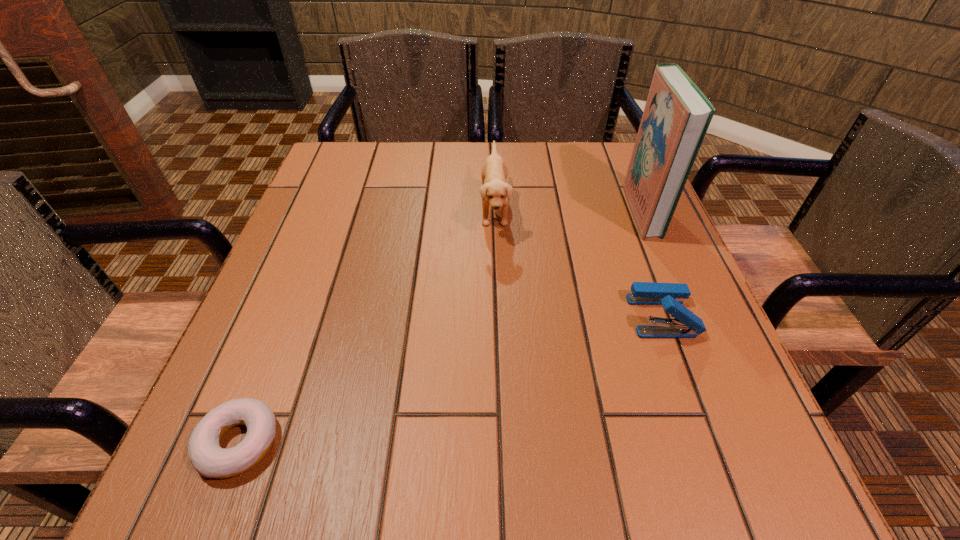
Identify the location of the tallest object. This screenshot has width=960, height=540. (676, 117).

Identify the location of the second object from left to right. Image resolution: width=960 pixels, height=540 pixels. (494, 191).

The height and width of the screenshot is (540, 960). Find the location of `the third shortest object`. the third shortest object is located at coordinates (494, 191).

The width and height of the screenshot is (960, 540). Identify the location of the second shortest object. (686, 324).

Locate an element on the screen. The height and width of the screenshot is (540, 960). the third farthest object is located at coordinates (686, 324).

Where is `the leftmost object`? The height and width of the screenshot is (540, 960). the leftmost object is located at coordinates (207, 457).

At what (x,y) coordinates should I click in order to perform the action: click on doughnut. Please return your answer as a coordinate pair (x, y). The width and height of the screenshot is (960, 540). Looking at the image, I should click on (207, 457).

Find the location of `vacant space located on the cover of the hardback book`. vacant space located on the cover of the hardback book is located at coordinates (491, 210).

I want to click on free region located on the cover of the hardback book, so click(564, 210).

Where is `vacant space located 0.230m on the cover of the hardback book`? This screenshot has height=540, width=960. vacant space located 0.230m on the cover of the hardback book is located at coordinates (530, 210).